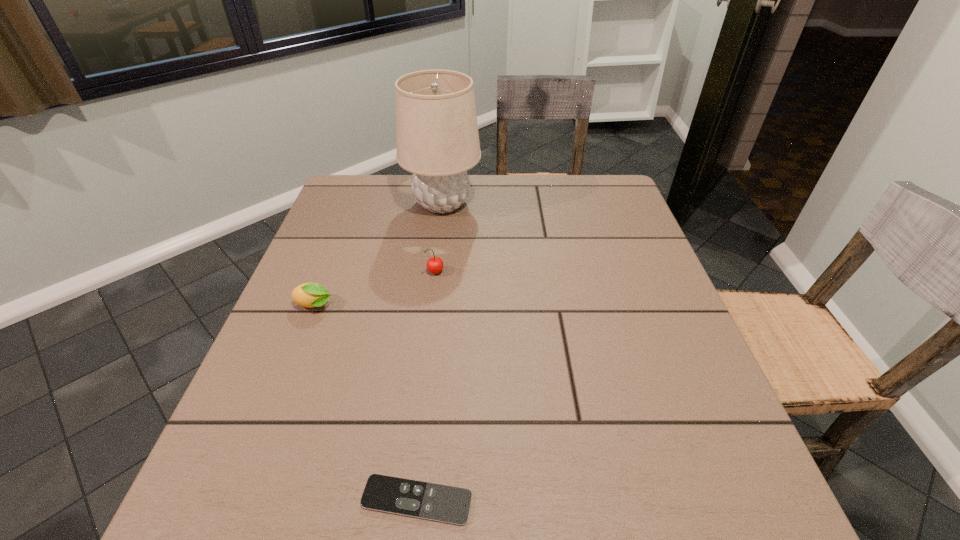
Locate an element on the screen. Image resolution: width=960 pixels, height=540 pixels. empty space that is in between the farthest object and the second tallest object is located at coordinates (439, 238).

Locate an element on the screen. This screenshot has width=960, height=540. free spot between the leftmost object and the lampshade is located at coordinates (378, 254).

Identify the location of object that is the closest to the leftmost object. (435, 264).

Identify which object is the third closest to the cherry. Please provide its 2D coordinates. Your answer should be formatted as a tuple, i.e. [(x, y)], where the tuple contains the x and y coordinates of a point satisfying the conditions above.

[(442, 503)]

Where is `free space that satisfies the following two spatial constraints: 1. with leaves positioned above the second nearest object; 2. on the left side of the nearest object`? The width and height of the screenshot is (960, 540). free space that satisfies the following two spatial constraints: 1. with leaves positioned above the second nearest object; 2. on the left side of the nearest object is located at coordinates (239, 500).

Where is `vacant region that satisfies the following two spatial constraints: 1. on the front side of the cherry; 2. on the right side of the tallest object`? The height and width of the screenshot is (540, 960). vacant region that satisfies the following two spatial constraints: 1. on the front side of the cherry; 2. on the right side of the tallest object is located at coordinates (434, 273).

The height and width of the screenshot is (540, 960). In order to click on free space that satisfies the following two spatial constraints: 1. with leaves positioned above the remote control; 2. on the left side of the leftmost object in this screenshot , I will do `click(239, 500)`.

This screenshot has height=540, width=960. I want to click on vacant position in the image that satisfies the following two spatial constraints: 1. with leaves positioned above the nearest object; 2. on the left side of the lemon, so click(239, 500).

You are a GUI agent. You are given a task and a screenshot of the screen. Output one action in this format:
    pyautogui.click(x=<x>, y=<y>)
    Task: Click on the vacant space that satisfies the following two spatial constraints: 1. on the front side of the farthest object; 2. on the right side of the second tallest object
    The height and width of the screenshot is (540, 960).
    Given the screenshot: What is the action you would take?
    pyautogui.click(x=434, y=273)